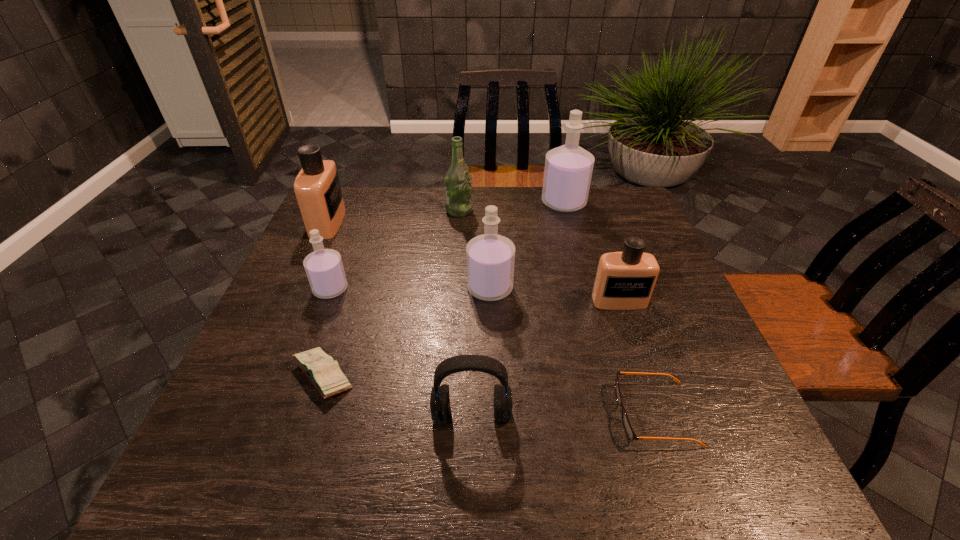
Where is `purple perfume that is the closest one to the right beige perfume`? The height and width of the screenshot is (540, 960). purple perfume that is the closest one to the right beige perfume is located at coordinates (490, 257).

Locate an element on the screen. This screenshot has width=960, height=540. purple perfume that is the nearest to the tallest object is located at coordinates (490, 257).

At what (x,y) coordinates should I click in order to perform the action: click on vacant position in the image that satisfies the following two spatial constraints: 1. on the front-facing side of the spectacles; 2. on the headband of the headset. Please return your answer as a coordinate pair (x, y). Looking at the image, I should click on (655, 415).

Locate an element on the screen. The width and height of the screenshot is (960, 540). free spot that satisfies the following two spatial constraints: 1. on the surface of the green beer bottle; 2. on the front side of the leftmost purple perfume is located at coordinates [x=454, y=289].